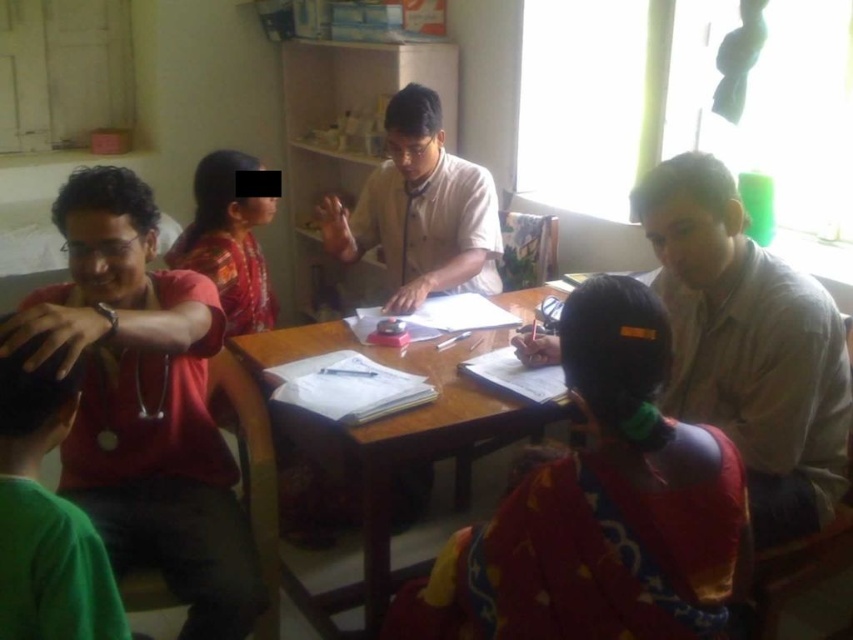
Question: Is matte red shirt at left smaller than wooden table at center?

Choices:
 (A) no
 (B) yes

Answer: (B)

Question: Can you confirm if matte red shirt at left is positioned above wooden table at center?

Choices:
 (A) no
 (B) yes

Answer: (B)

Question: Does light brown shirt at center appear under wooden table at center?

Choices:
 (A) no
 (B) yes

Answer: (A)

Question: Which point is closer to the camera taking this photo?

Choices:
 (A) (126, 211)
 (B) (469, 483)
 (C) (527, 480)
 (D) (791, 397)

Answer: (C)

Question: Which of the following is the closest to the observer?

Choices:
 (A) (706, 339)
 (B) (386, 230)

Answer: (A)

Question: Which point is farther to the camera?

Choices:
 (A) (805, 387)
 (B) (701, 433)
 (C) (93, 460)

Answer: (C)